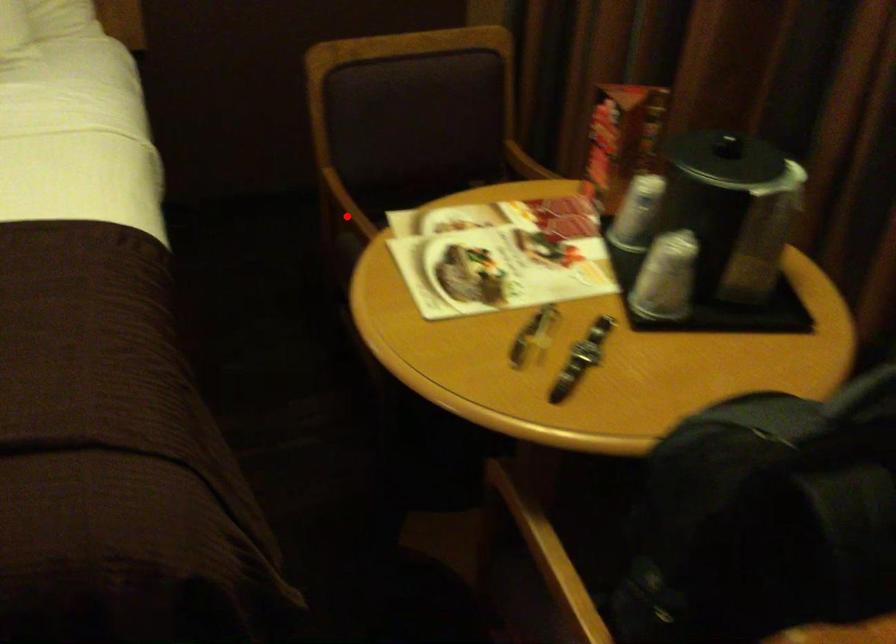
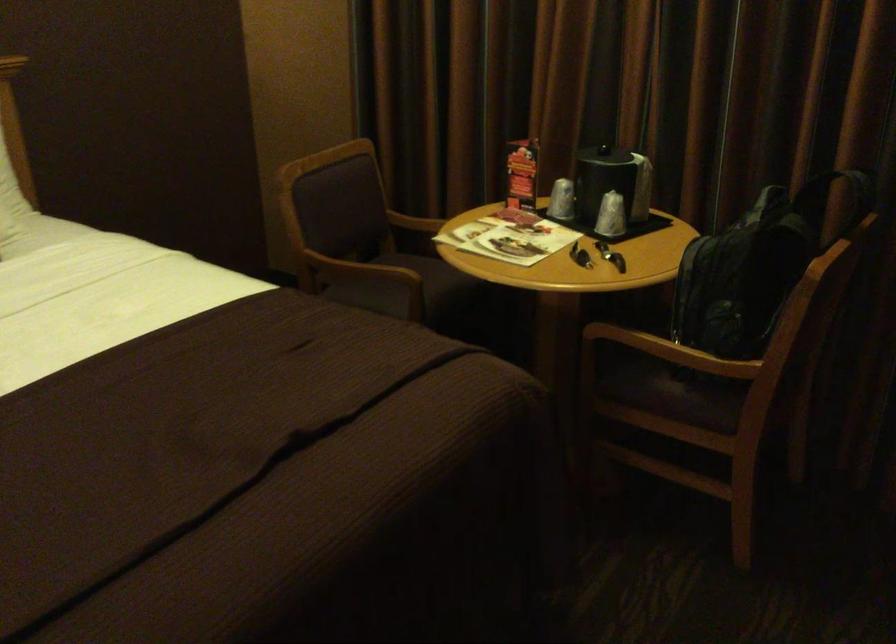
Question: I am providing you with two images of the same scene from different viewpoints. A red point is shown in image1. For the corresponding object point in image2, is it positioned nearer or farther from the camera?

Choices:
 (A) Nearer
 (B) Farther

Answer: (B)